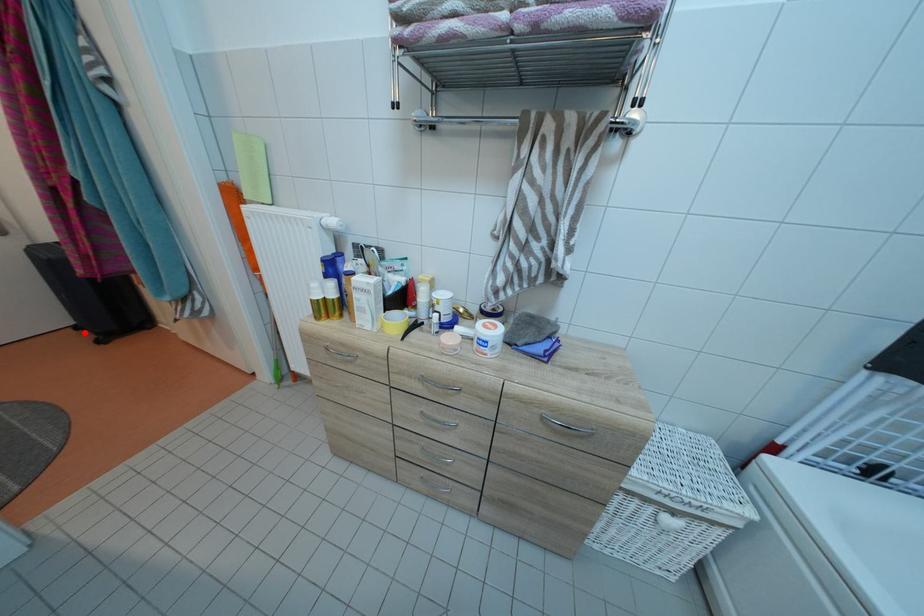
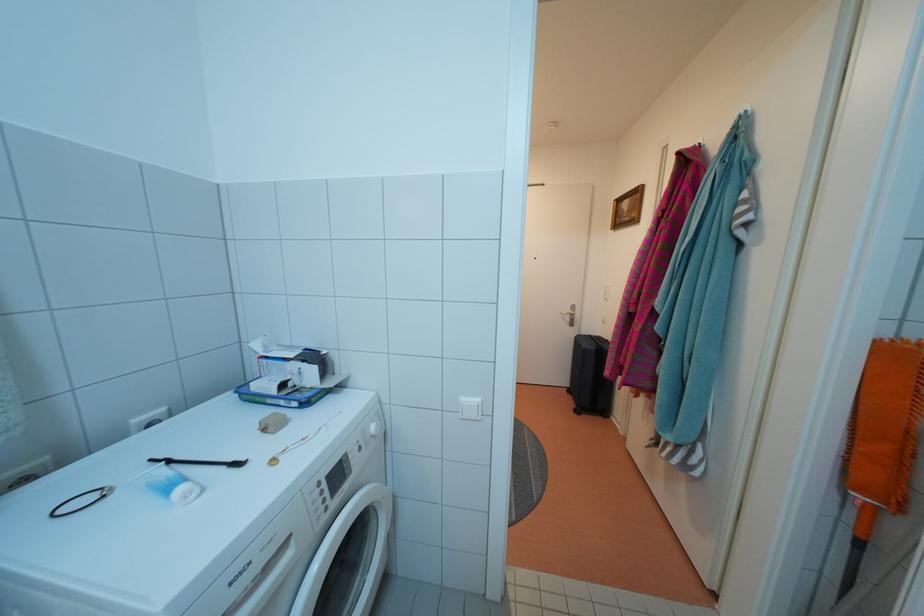
Question: I am providing you with two images of the same scene from different viewpoints. A red point is marked on the first image. Can you still see the location of the red point in image 2?

Choices:
 (A) Yes
 (B) No

Answer: (A)